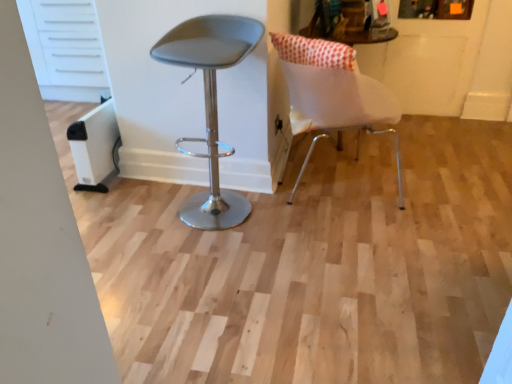
Question: Considering the positions of white matte chair at right, the 1th chair when ordered from right to left, and matte gray stool at center, which is the first chair in left-to-right order, in the image, is white matte chair at right, the 1th chair when ordered from right to left, taller or shorter than matte gray stool at center, which is the first chair in left-to-right order,?

Choices:
 (A) short
 (B) tall

Answer: (A)

Question: Considering their positions, is white matte chair at right, the 1th chair when ordered from right to left, located in front of or behind matte gray stool at center, which is the first chair in left-to-right order?

Choices:
 (A) front
 (B) behind

Answer: (B)

Question: Estimate the real-world distances between objects in this image. Which object is closer to the matte gray stool at center, the second chair from the right?

Choices:
 (A) white fabric cushion at upper right
 (B) white matte chair at right, the 1th chair when ordered from right to left

Answer: (B)

Question: Which object is the farthest from the white matte chair at right, acting as the 2th chair starting from the left?

Choices:
 (A) matte gray stool at center, which is the first chair in left-to-right order
 (B) white fabric cushion at upper right

Answer: (B)